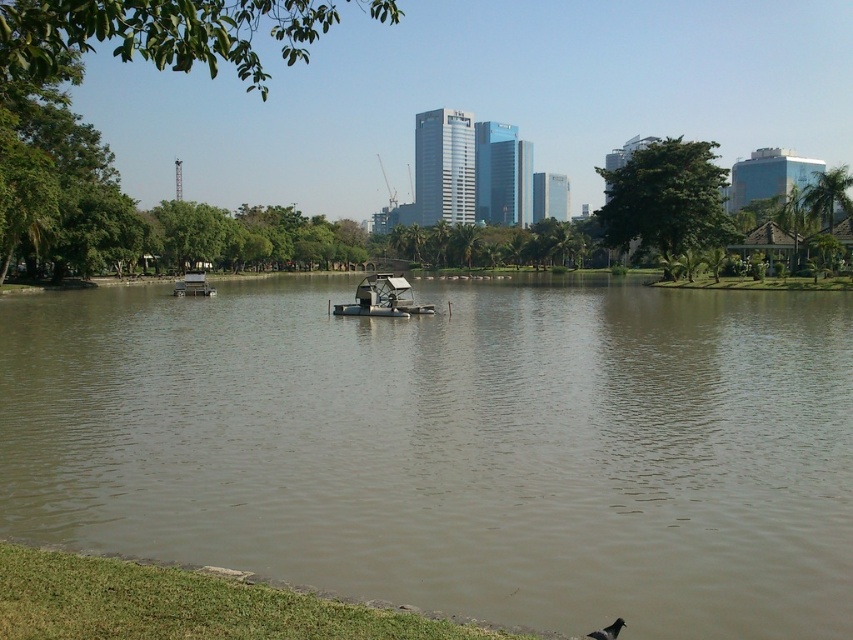
Question: Is brown murky water at center to the right of gray matte bird at lower right from the viewer's perspective?

Choices:
 (A) yes
 (B) no

Answer: (B)

Question: Which point is farther to the camera?

Choices:
 (A) gray matte bird at lower right
 (B) metallic silver paddlewheel boat at center
 (C) brown murky water at center

Answer: (B)

Question: Which point appears farthest from the camera in this image?

Choices:
 (A) (329, 432)
 (B) (598, 630)
 (C) (213, 292)

Answer: (C)

Question: Does metallic silver paddlewheel boat at center have a greater width compared to white plastic boat at center?

Choices:
 (A) yes
 (B) no

Answer: (B)

Question: Can you confirm if brown murky water at center is smaller than gray matte bird at lower right?

Choices:
 (A) yes
 (B) no

Answer: (B)

Question: Which point appears closest to the camera in this image?

Choices:
 (A) (502, 604)
 (B) (374, 301)
 (C) (595, 632)
 (D) (184, 284)

Answer: (C)